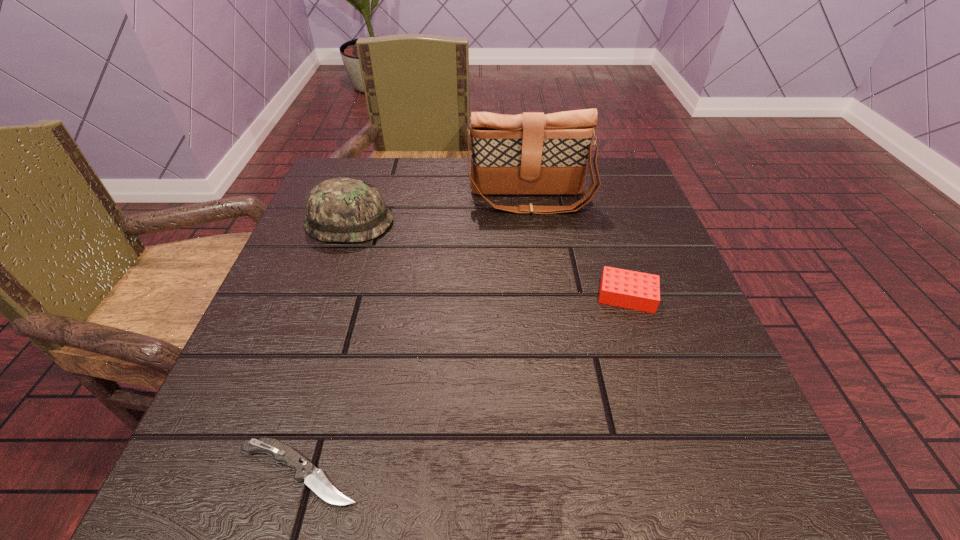
Locate an element on the screen. vacant space at the far edge is located at coordinates (534, 215).

In the image, there is a desktop. At what (x,y) coordinates should I click in order to perform the action: click on vacant area at the left edge. Please return your answer as a coordinate pair (x, y). Looking at the image, I should click on (238, 380).

Locate an element on the screen. The height and width of the screenshot is (540, 960). vacant space at the right edge of the desktop is located at coordinates (721, 367).

Image resolution: width=960 pixels, height=540 pixels. I want to click on free space at the far left corner of the desktop, so click(x=331, y=176).

At what (x,y) coordinates should I click in order to perform the action: click on vacant region at the near left corner of the desktop. Please return your answer as a coordinate pair (x, y). Looking at the image, I should click on (235, 475).

Where is `vacant space at the far right corner of the desktop`? vacant space at the far right corner of the desktop is located at coordinates (600, 161).

This screenshot has width=960, height=540. What are the coordinates of `free space that is in between the tallest object and the Lego` in the screenshot? It's located at (579, 247).

The height and width of the screenshot is (540, 960). Find the location of `free space that is in between the second shortest object and the pocketknife`. free space that is in between the second shortest object and the pocketknife is located at coordinates (463, 384).

Identify the location of free space between the tallest object and the second nearest object. The height and width of the screenshot is (540, 960). (579, 247).

This screenshot has width=960, height=540. Find the location of `vacant area that lies between the headwear and the pocketknife`. vacant area that lies between the headwear and the pocketknife is located at coordinates (324, 347).